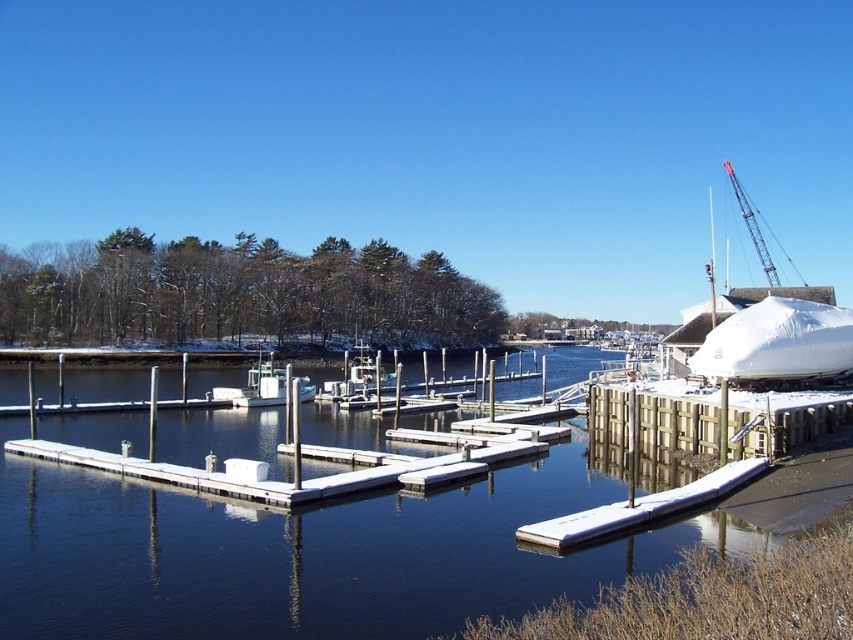
You are a photographer planning to capture both the white tarpaulin boat at right and the white matte boat at center in a single shot. Given their sizes in the image, which boat would you need to position closer to the camera to ensure both appear equally large in the photo?

The white tarpaulin boat at right occupies less space than the white matte boat at center, so to make them appear equally large in the photo, you should position the white tarpaulin boat at right closer to the camera than the white matte boat at center.

You are standing on the white matte dock at center and want to look down to see the clear water at dock center. In which direction should you look?

You should look downward because the clear water at dock center is located below the white matte dock at center.